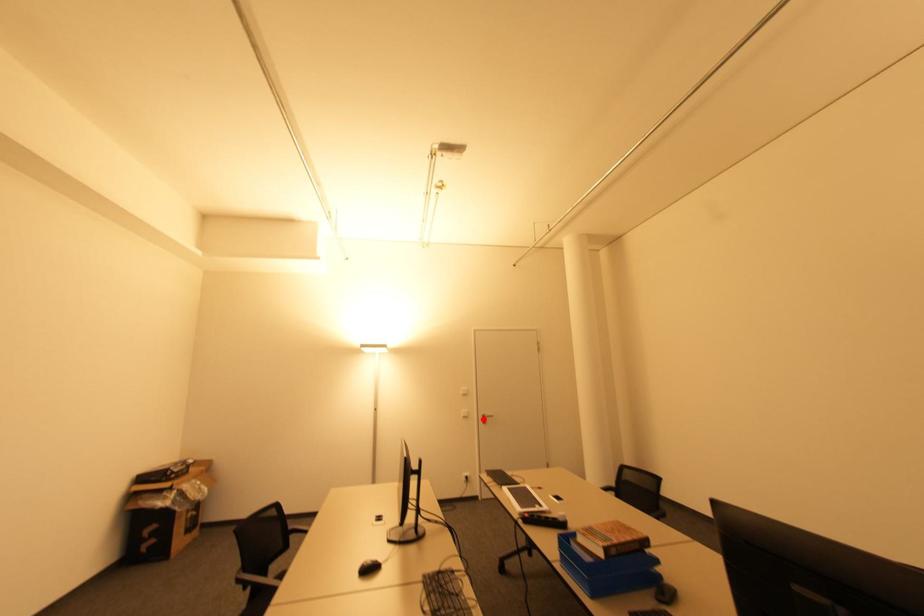
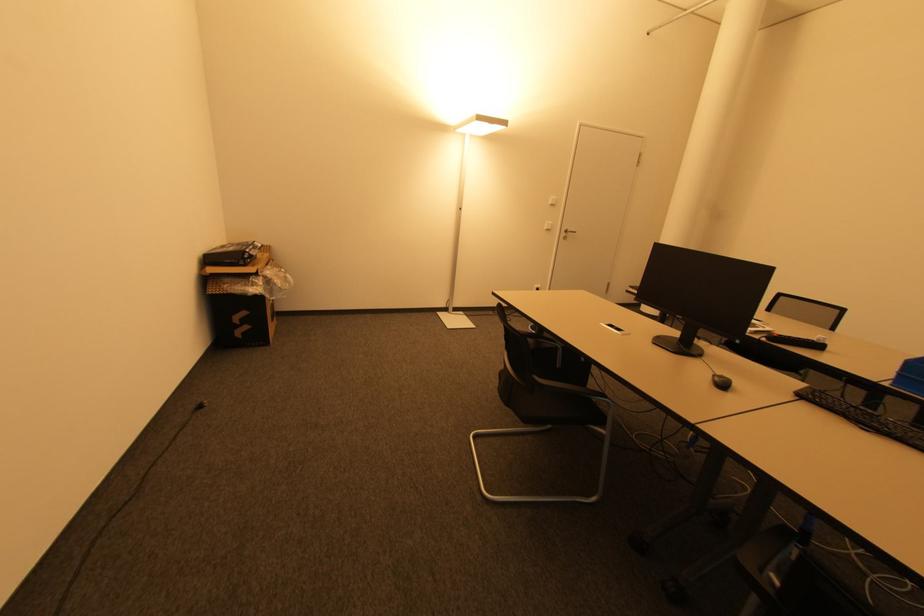
Question: I am providing you with two images of the same scene from different viewpoints. Given a red point in image1, look at the same physical point in image2. Is it:

Choices:
 (A) Closer to the viewpoint
 (B) Farther from the viewpoint

Answer: (A)